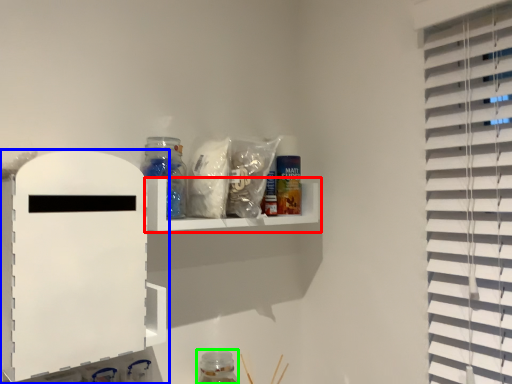
Question: Considering the real-world distances, which object is farthest from shelf (highlighted by a red box)? shelf (highlighted by a blue box) or bottle (highlighted by a green box)?

Choices:
 (A) shelf
 (B) bottle

Answer: (B)